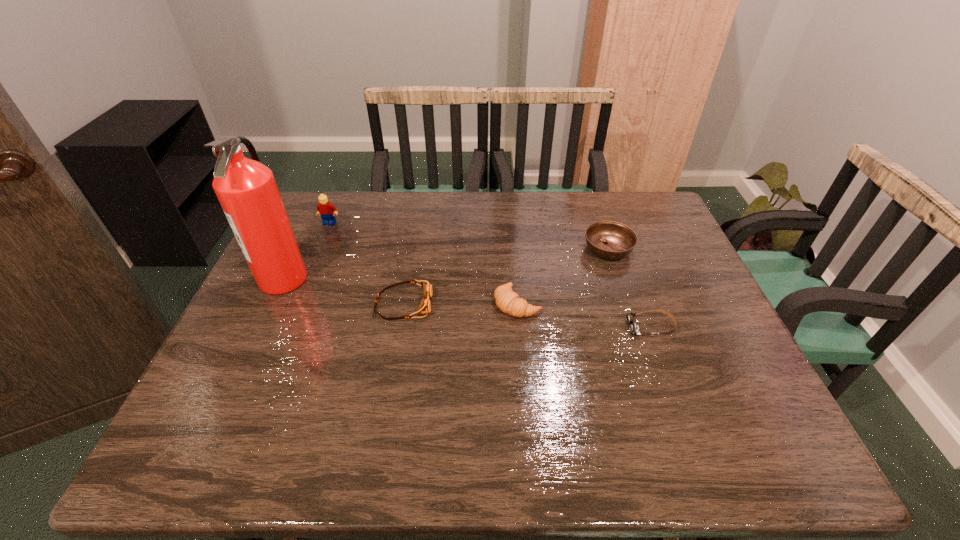
At what (x,y) coordinates should I click in order to perform the action: click on soup bowl that is at the right edge. Please return your answer as a coordinate pair (x, y). Looking at the image, I should click on (612, 240).

Where is `goggles that is at the right edge`? This screenshot has width=960, height=540. goggles that is at the right edge is located at coordinates (634, 329).

Find the location of a particular element. This screenshot has width=960, height=540. object at the far left corner is located at coordinates (325, 208).

At what (x,y) coordinates should I click in order to perform the action: click on vacant space at the far edge of the desktop. Please return your answer as a coordinate pair (x, y). The width and height of the screenshot is (960, 540). Looking at the image, I should click on coord(531,230).

Where is `blank area at the near edge`? blank area at the near edge is located at coordinates (320, 428).

Where is `vacant space at the right edge of the desktop`? vacant space at the right edge of the desktop is located at coordinates (661, 299).

This screenshot has width=960, height=540. Identify the location of blank space at the near left corner of the desktop. (182, 464).

Image resolution: width=960 pixels, height=540 pixels. I want to click on free space at the near right corner, so click(x=755, y=442).

In order to click on free space between the fire extinguisher and the third object from right to left in this screenshot , I will do `click(400, 291)`.

Where is `vacant space that is in between the crescent roll and the shortest object`? This screenshot has width=960, height=540. vacant space that is in between the crescent roll and the shortest object is located at coordinates (584, 315).